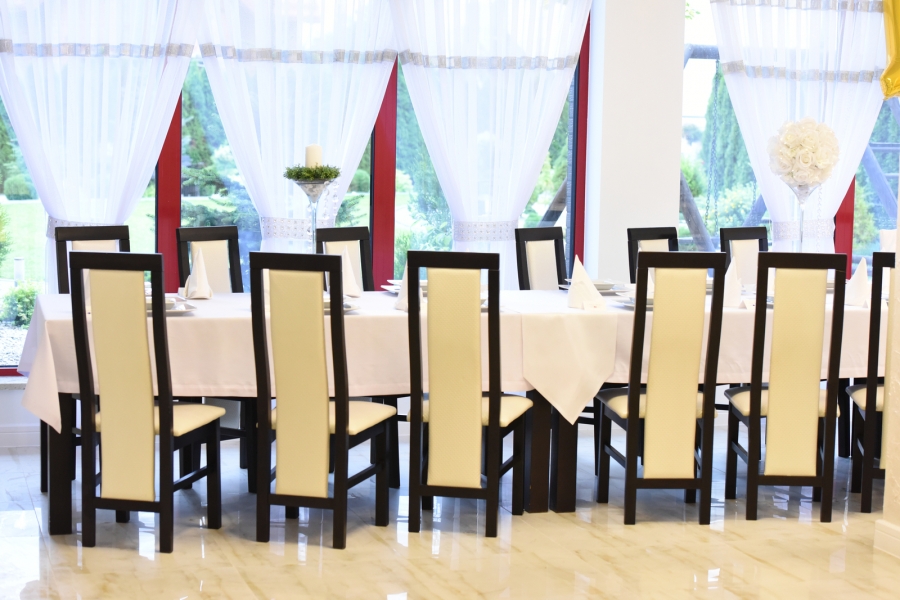
At what (x,y) coordinates should I click in order to perform the action: click on chair bars. Please return your answer as a coordinate pair (x, y). This screenshot has width=900, height=600. Looking at the image, I should click on (193, 479), (364, 475), (513, 466), (616, 451), (742, 455), (862, 454).